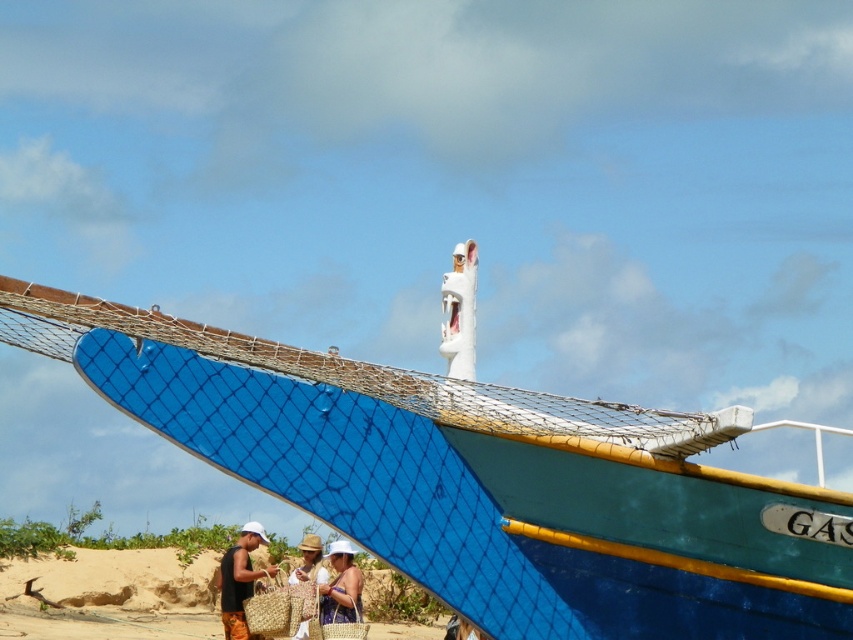
Does blue painted wood boat at center appear on the left side of beige woven hat at center?

In fact, blue painted wood boat at center is to the right of beige woven hat at center.

Who is more distant from viewer, (558,531) or (316,561)?

Point (316,561)

The image size is (853, 640). Find the location of `blue painted wood boat at center`. blue painted wood boat at center is located at coordinates (479, 476).

Which is more to the left, blue painted wood boat at center or black woven bag at lower left?

Positioned to the left is black woven bag at lower left.

Between blue painted wood boat at center and black woven bag at lower left, which one has more height?

blue painted wood boat at center is taller.

Is point (213, 420) more distant than point (245, 628)?

No, (213, 420) is in front of (245, 628).

Where is `blue painted wood boat at center`? blue painted wood boat at center is located at coordinates (479, 476).

Who is taller, beige woven baskets at lower center or black woven bag at lower left?

beige woven baskets at lower center

Is point (30, 630) farther from camera compared to point (241, 595)?

Yes.

Locate an element on the screen. beige woven baskets at lower center is located at coordinates (111, 595).